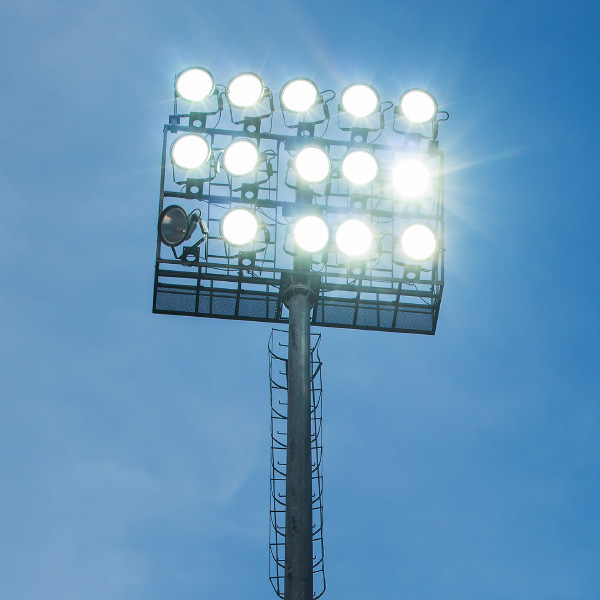
The image size is (600, 600). I want to click on lights in middle row, so click(201, 150), click(240, 155), click(309, 159), click(359, 165), click(414, 173).